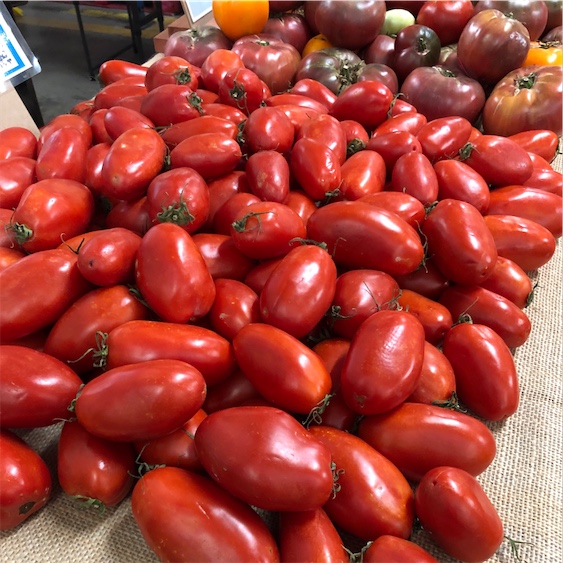
The height and width of the screenshot is (563, 563). I want to click on concrete floor, so click(61, 87).